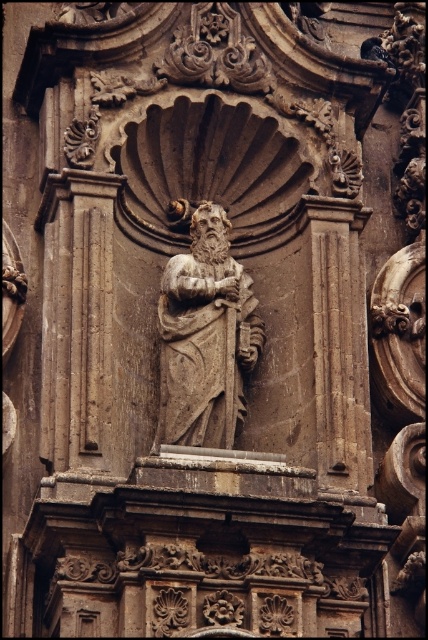
Question: From the image, what is the correct spatial relationship of brown stone statue at center in relation to smooth stone column at center?

Choices:
 (A) right
 (B) left

Answer: (B)

Question: Which object is farther from the camera taking this photo?

Choices:
 (A) smooth stone column at center
 (B) brown stone statue at center

Answer: (B)

Question: Is brown stone statue at center thinner than smooth stone column at center?

Choices:
 (A) no
 (B) yes

Answer: (B)

Question: Considering the relative positions of brown stone statue at center and smooth stone column at center in the image provided, where is brown stone statue at center located with respect to smooth stone column at center?

Choices:
 (A) left
 (B) right

Answer: (A)